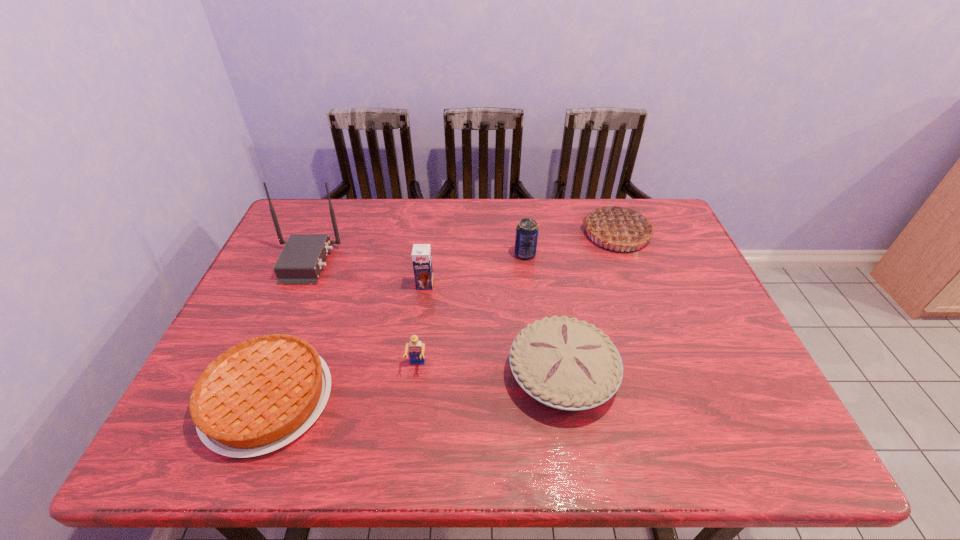
I want to click on unoccupied area between the fourth shortest object and the chocolate milk, so click(x=475, y=269).

Where is `empty location between the leftmost pie and the soda`? empty location between the leftmost pie and the soda is located at coordinates (396, 327).

You are a GUI agent. You are given a task and a screenshot of the screen. Output one action in this format:
    pyautogui.click(x=<x>, y=<y>)
    Task: Click on the empty space between the Lego and the chocolate milk
    The height and width of the screenshot is (540, 960).
    Given the screenshot: What is the action you would take?
    point(421,325)

Identify the location of unoccupied area between the leftmost pie and the Lego. The image size is (960, 540). (343, 382).

Locate an element on the screen. This screenshot has height=540, width=960. vacant space in between the router and the leftmost pie is located at coordinates (287, 330).

The height and width of the screenshot is (540, 960). Identify the location of vacant point located between the farthest pie and the shortest pie. click(x=442, y=316).

Locate an element on the screen. The height and width of the screenshot is (540, 960). vacant space that is in between the second pie from left to right and the Lego is located at coordinates (490, 370).

Identify the location of the closest object to the tallest object. (258, 396).

Choose which object is the second nearest neighbor to the chocolate milk. Please provide its 2D coordinates. Your answer should be formatted as a tuple, i.e. [(x, y)], where the tuple contains the x and y coordinates of a point satisfying the conditions above.

[(300, 262)]

I want to click on pie that is the nearest to the router, so point(258,396).